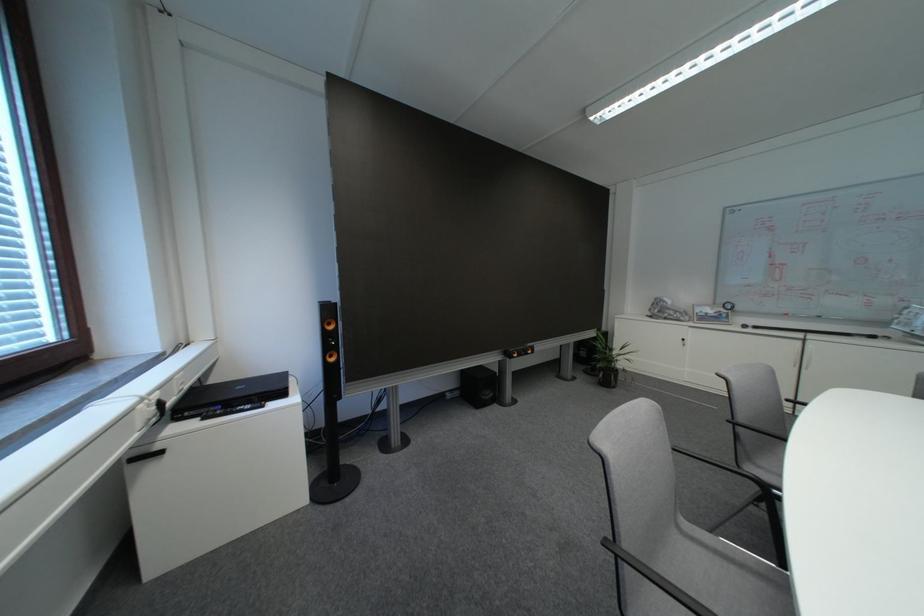
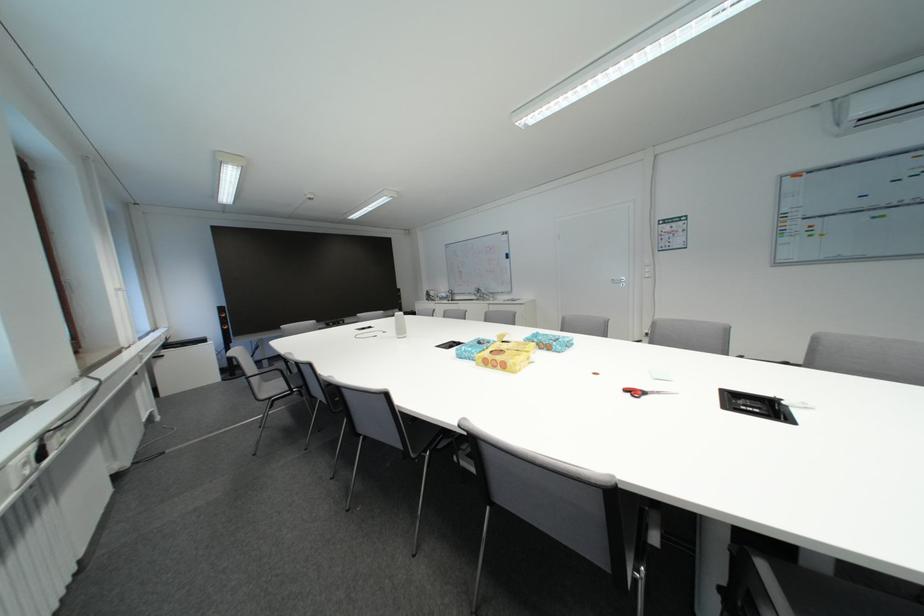
In the second image, find the point that corresponds to [416,444] in the first image.

(282, 368)